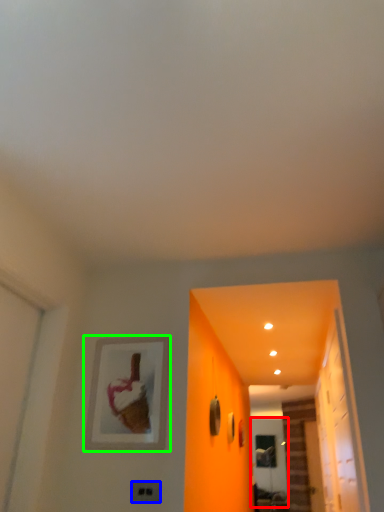
Question: Which is farther away from screen door (highlighted by a red box)? electric outlet (highlighted by a blue box) or picture frame (highlighted by a green box)?

Choices:
 (A) electric outlet
 (B) picture frame

Answer: (A)